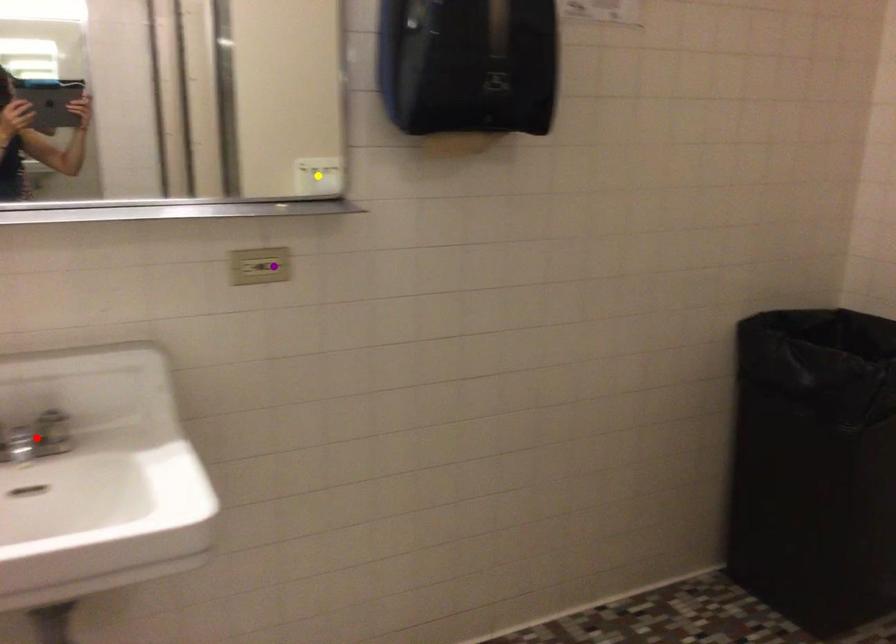
Order these from nearest to farthest:
red point, yellow point, purple point

1. red point
2. purple point
3. yellow point